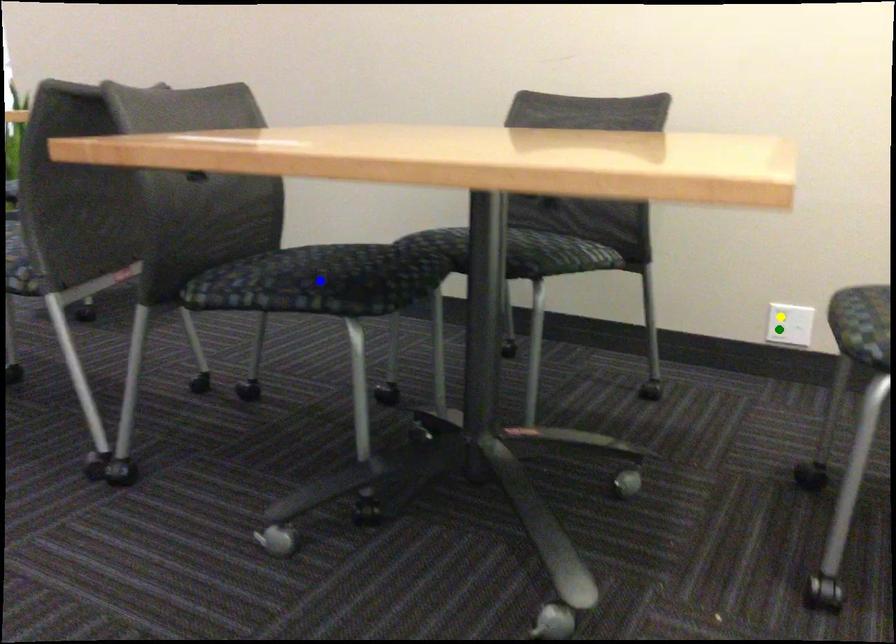
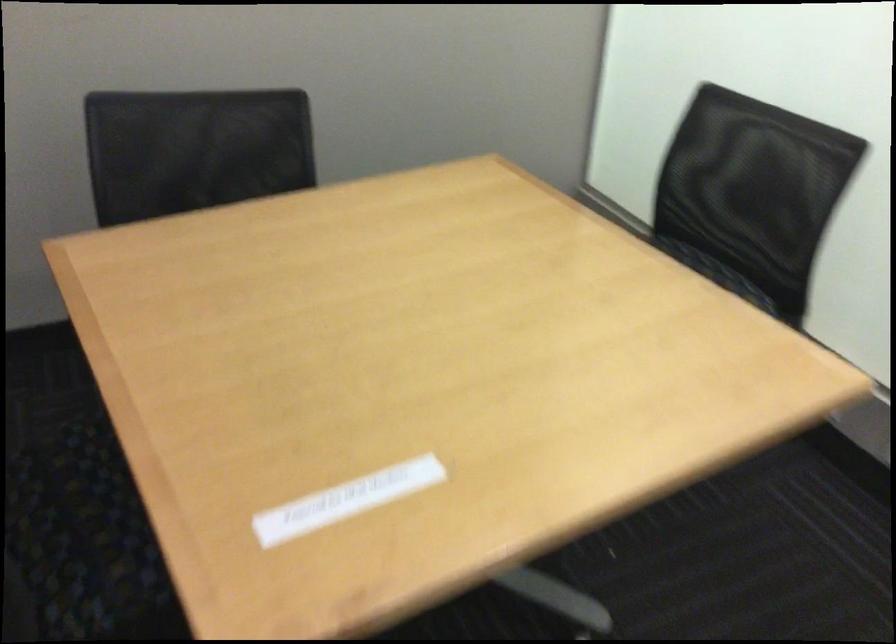
I am providing you with two images of the same scene from different viewpoints. Three points are marked in image1. Which point corresponds to a part or object that is occluded in image2?In image1, three points are marked. Which of them correspond to a part or object that is occluded in image2?Among the three points shown in image1, which one corresponds to a part or object that is no longer visible due to occlusion in image2?

Invisible in image2: green point, yellow point, blue point.